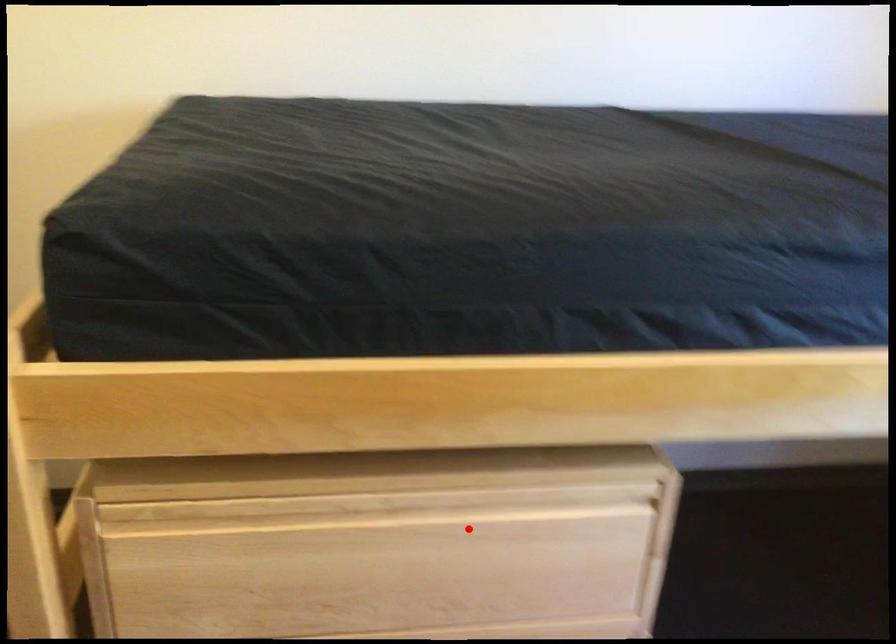
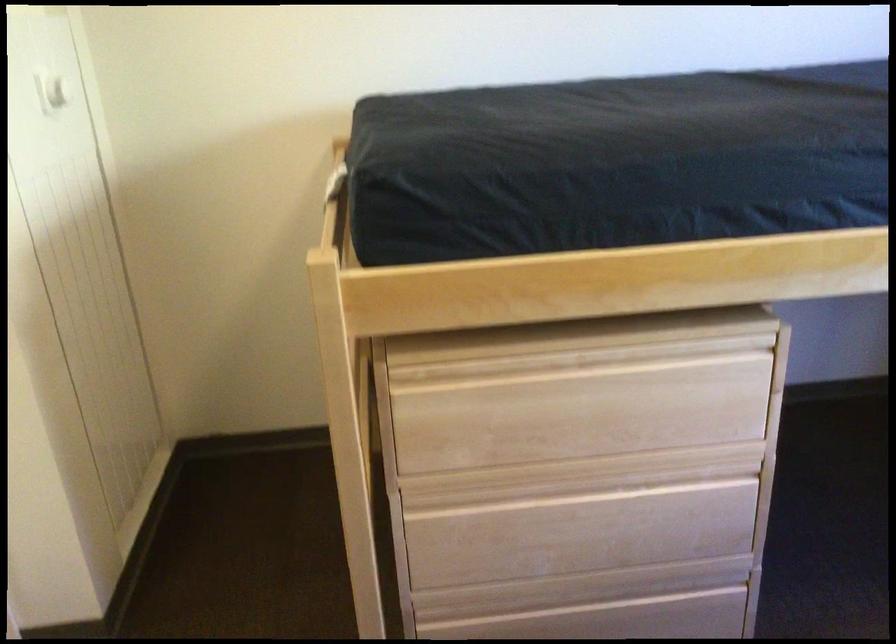
Question: I am providing you with two images of the same scene from different viewpoints. Image1 has a red point marked. In image2, the corresponding 3D location appears at what relative position? Reply with the corresponding letter.

Choices:
 (A) Closer
 (B) Farther

Answer: (B)